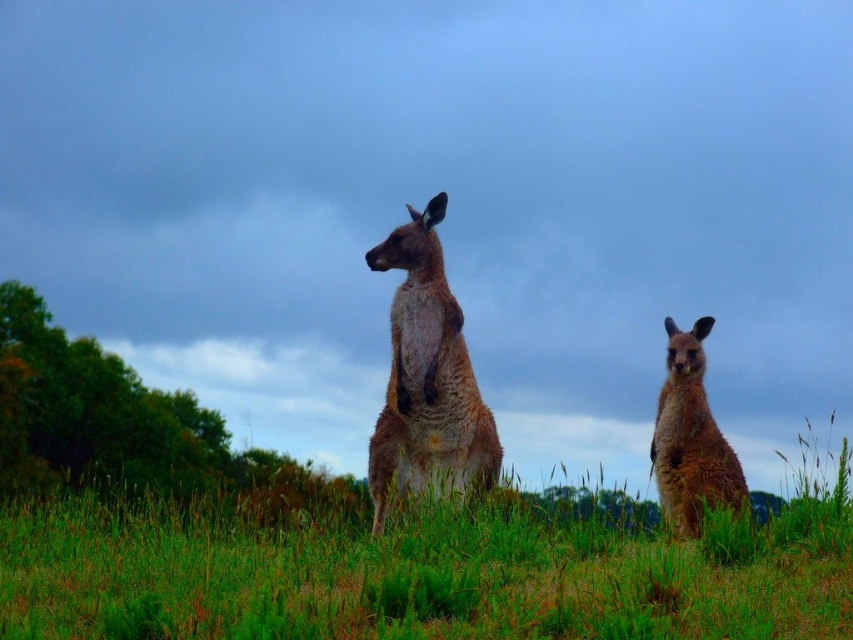
You are a photographer trying to capture both the green grassy at center and the furry brown kangaroo at center in a single frame. Based on their sizes, which one will occupy more space in the photo?

The green grassy at center will occupy more space in the photo because its width is larger than the furry brown kangaroo at center.

You are a wildlife photographer with a camera that has a maximum zoom range of 5 feet. You want to take a photo of both the furry brown kangaroo at center and the brown furry kangaroo at right without moving closer. Can your camera capture both kangaroos in the same frame?

The furry brown kangaroo at center is 5.59 feet from the brown furry kangaroo at right. Since the distance between them is greater than the camera maximum zoom range of 5 feet, the camera cannot capture both kangaroos in the same frame without moving closer.

You are a photographer trying to capture both the green grassy at center and the brown furry kangaroo at right in a single shot. Based on their positions, which one would appear closer to the camera in the photo?

The green grassy at center appears closer to the camera because it is positioned in front of the brown furry kangaroo at right.